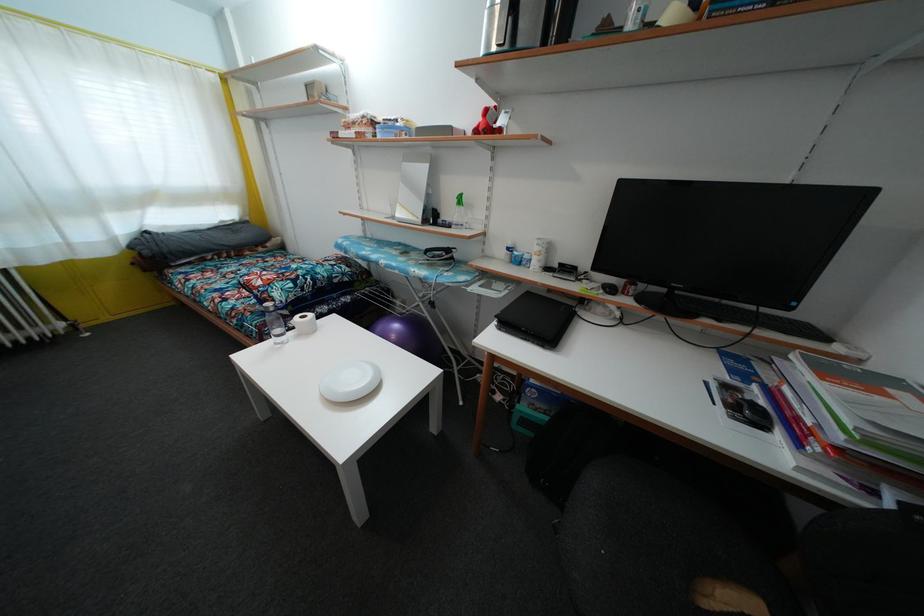
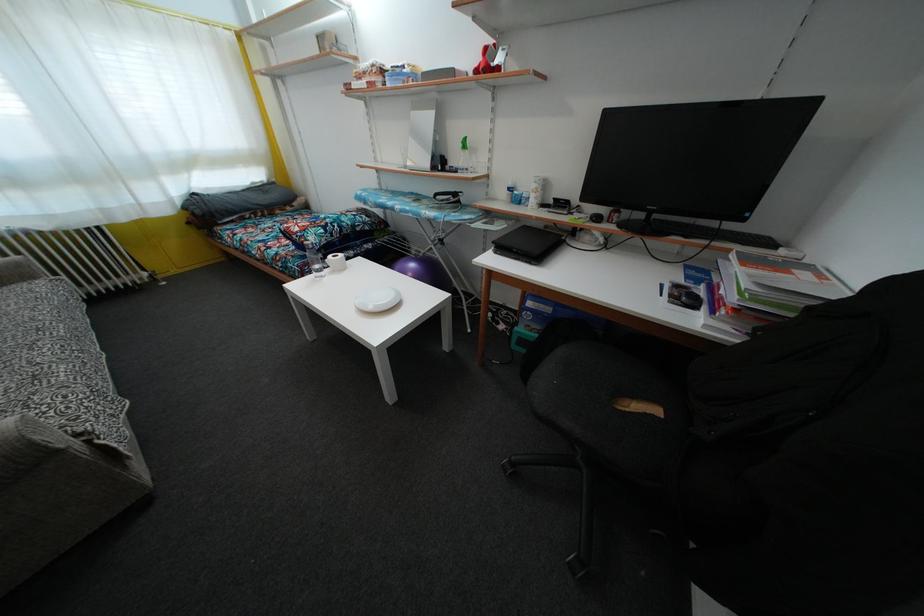
The point at (x=512, y=331) is marked in the first image. Where is the corresponding point in the second image?

(506, 254)